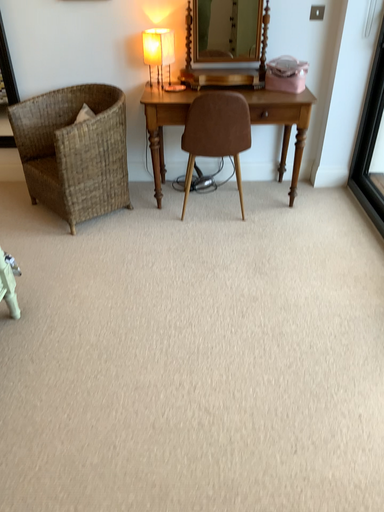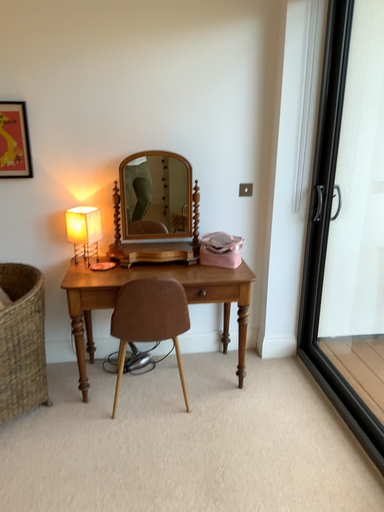
Question: Which way did the camera rotate in the video?

Choices:
 (A) rotated downward
 (B) rotated upward

Answer: (B)